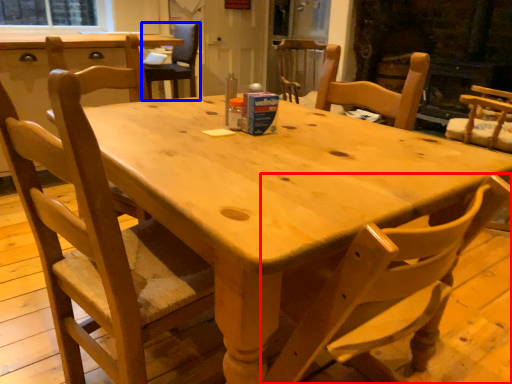
Question: Which object is further to the camera taking this photo, chair (highlighted by a red box) or chair (highlighted by a blue box)?

Choices:
 (A) chair
 (B) chair

Answer: (B)